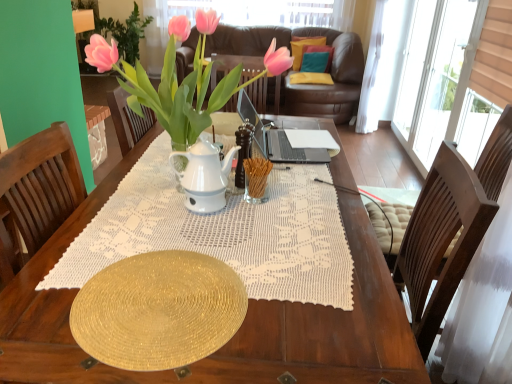
Question: Which direction should I rotate to face velvet yellow pillow at upper center, acting as the 3th pillow starting from the bottom, — up or down?

Choices:
 (A) up
 (B) down

Answer: (A)

Question: Which direction should I rotate to look at teal fabric pillow at upper center, the 2th pillow from the bottom?

Choices:
 (A) right
 (B) left

Answer: (A)

Question: Could pink glossy houseplant at upper center be considered to be inside teal fabric pillow at upper center, the 2th pillow from the bottom?

Choices:
 (A) no
 (B) yes

Answer: (A)

Question: Is teal fabric pillow at upper center, the 2th pillow from the bottom, looking in the opposite direction of pink glossy houseplant at upper center?

Choices:
 (A) yes
 (B) no

Answer: (B)

Question: Considering the relative sizes of teal fabric pillow at upper center, arranged as the 2th pillow when viewed from the top, and pink glossy houseplant at upper center in the image provided, is teal fabric pillow at upper center, arranged as the 2th pillow when viewed from the top, bigger than pink glossy houseplant at upper center?

Choices:
 (A) no
 (B) yes

Answer: (A)

Question: From the image's perspective, would you say teal fabric pillow at upper center, the 2th pillow from the bottom, is shown under pink glossy houseplant at upper center?

Choices:
 (A) no
 (B) yes

Answer: (A)

Question: Considering the relative positions of teal fabric pillow at upper center, the 2th pillow from the bottom, and pink glossy houseplant at upper center in the image provided, is teal fabric pillow at upper center, the 2th pillow from the bottom, to the left of pink glossy houseplant at upper center from the viewer's perspective?

Choices:
 (A) no
 (B) yes

Answer: (A)

Question: Considering the relative sizes of teal fabric pillow at upper center, the 2th pillow from the bottom, and pink glossy houseplant at upper center in the image provided, is teal fabric pillow at upper center, the 2th pillow from the bottom, smaller than pink glossy houseplant at upper center?

Choices:
 (A) no
 (B) yes

Answer: (B)

Question: From the image's perspective, is velvet yellow pillow at upper center, which ranks as the 1th pillow in top-to-bottom order, on top of teal fabric pillow at upper center, the 2th pillow from the bottom?

Choices:
 (A) no
 (B) yes

Answer: (B)

Question: Considering the relative positions of velvet yellow pillow at upper center, which ranks as the 1th pillow in top-to-bottom order, and teal fabric pillow at upper center, the 2th pillow from the bottom, in the image provided, is velvet yellow pillow at upper center, which ranks as the 1th pillow in top-to-bottom order, to the left of teal fabric pillow at upper center, the 2th pillow from the bottom, from the viewer's perspective?

Choices:
 (A) no
 (B) yes

Answer: (B)

Question: Does velvet yellow pillow at upper center, which ranks as the 1th pillow in top-to-bottom order, appear on the right side of teal fabric pillow at upper center, arranged as the 2th pillow when viewed from the top?

Choices:
 (A) no
 (B) yes

Answer: (A)

Question: Is velvet yellow pillow at upper center, which ranks as the 1th pillow in top-to-bottom order, positioned before teal fabric pillow at upper center, the 2th pillow from the bottom?

Choices:
 (A) yes
 (B) no

Answer: (B)

Question: Is velvet yellow pillow at upper center, acting as the 3th pillow starting from the bottom, smaller than teal fabric pillow at upper center, arranged as the 2th pillow when viewed from the top?

Choices:
 (A) yes
 (B) no

Answer: (B)

Question: Is velvet yellow pillow at upper center, which ranks as the 1th pillow in top-to-bottom order, positioned with its back to teal fabric pillow at upper center, arranged as the 2th pillow when viewed from the top?

Choices:
 (A) no
 (B) yes

Answer: (A)

Question: Is yellow fabric pillow at center, marked as the first pillow in a bottom-to-top arrangement, outside velvet yellow pillow at upper center, which ranks as the 1th pillow in top-to-bottom order?

Choices:
 (A) yes
 (B) no

Answer: (A)